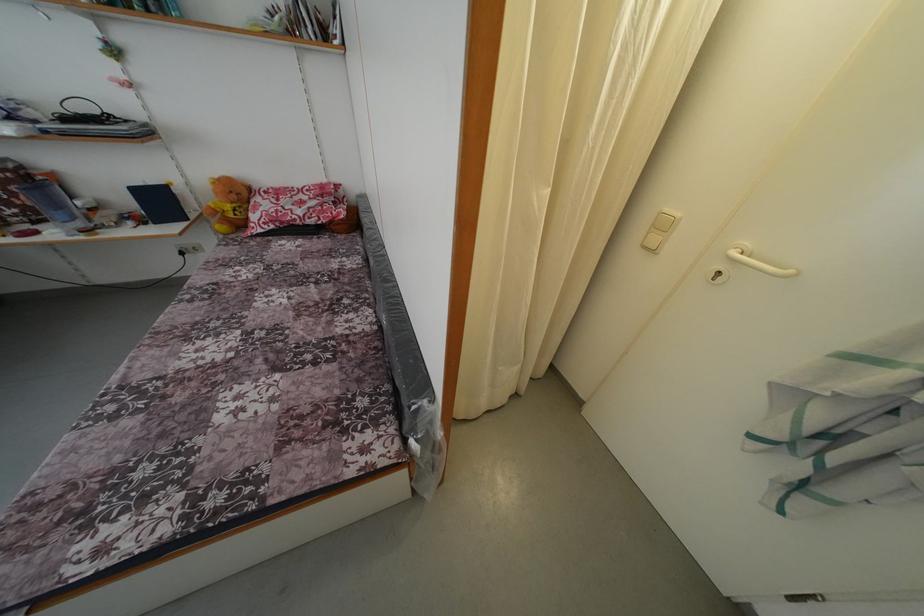
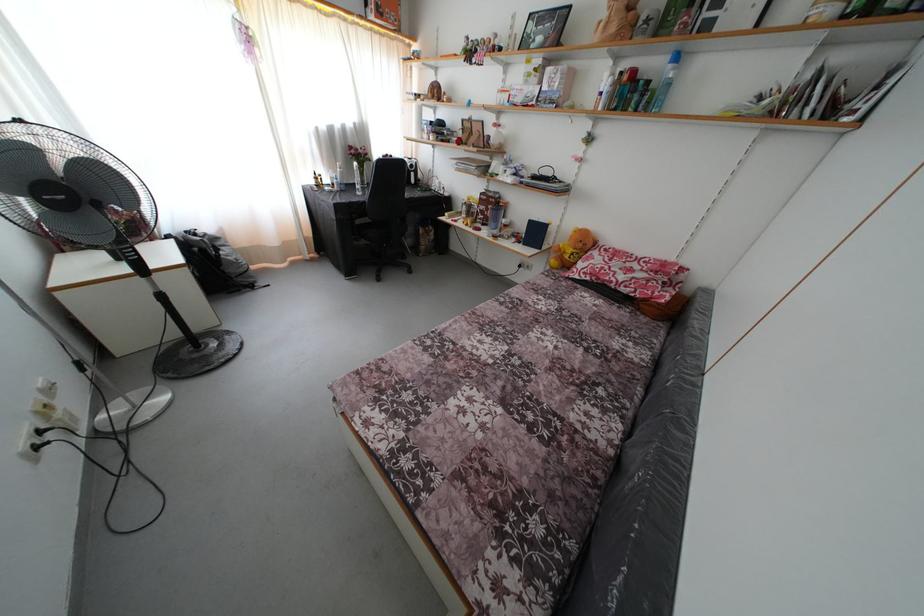
The point at (232, 251) is marked in the first image. Where is the corresponding point in the second image?

(552, 282)